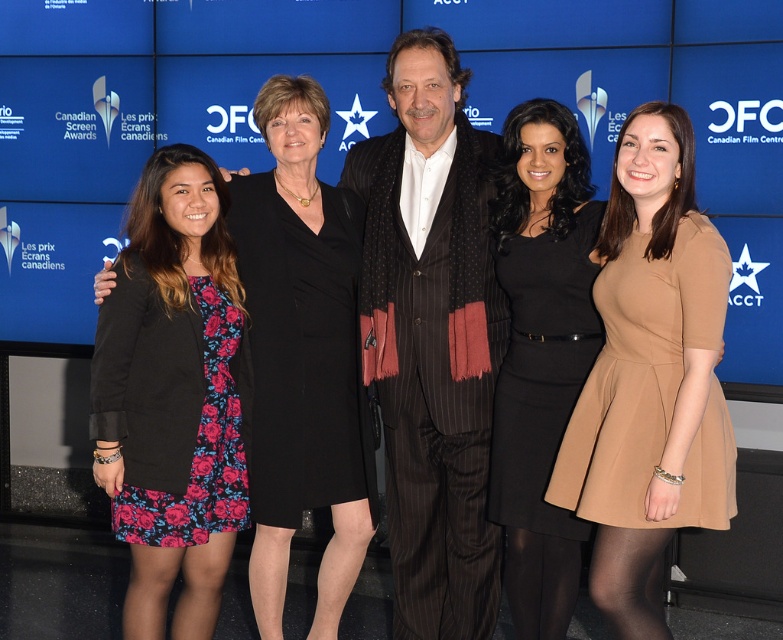
Question: Observing the image, what is the correct spatial positioning of matte beige dress at center in reference to black satin dress at center?

Choices:
 (A) right
 (B) left

Answer: (A)

Question: Estimate the real-world distances between objects in this image. Which object is closer to the striped wool suit at center?

Choices:
 (A) floral dress at left
 (B) matte beige dress at center
 (C) black satin dress at center
 (D) floral dress at center

Answer: (C)

Question: Which object appears farthest from the camera in this image?

Choices:
 (A) floral dress at left
 (B) matte beige dress at center
 (C) black satin dress at center

Answer: (C)

Question: Which point appears closest to the camera in this image?

Choices:
 (A) (554, 584)
 (B) (298, 349)
 (C) (439, 170)

Answer: (A)

Question: Is striped wool suit at center in front of floral dress at center?

Choices:
 (A) yes
 (B) no

Answer: (B)

Question: Can you confirm if matte beige dress at center is thinner than floral dress at center?

Choices:
 (A) no
 (B) yes

Answer: (B)